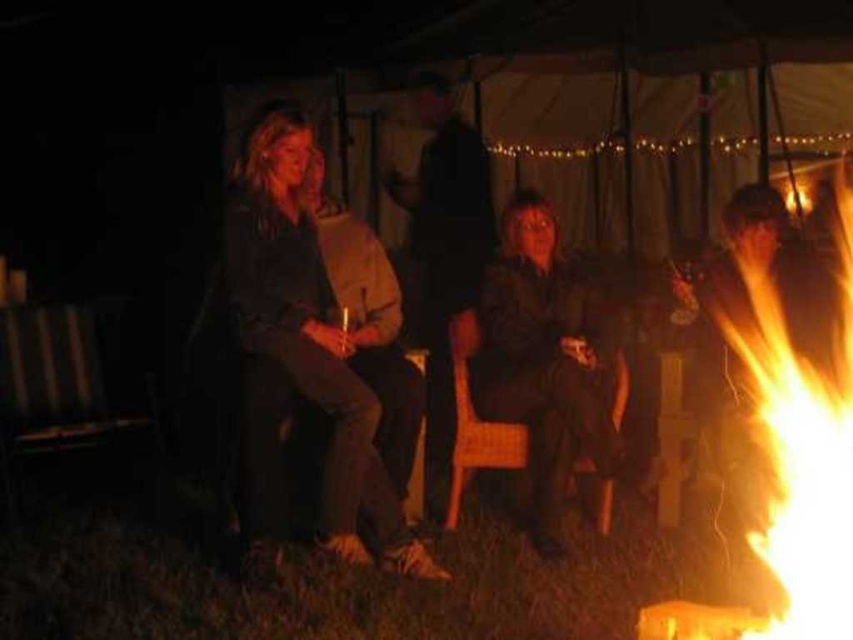
You are standing at the origin point of the coordinate system in the scene. The wooden slats chair at left is located at point 0.600, 0.080. If you want to move towards the campfire, which direction should you head from your current position?

The wooden slats chair at left is located at coordinates [67,384]. Since the campfire is the central focus of the scene and typically positioned at the center, moving towards the center coordinates would lead you toward the campfire.

You are standing near the campfire and want to place a small gift on the wooden chair at center without touching the dark brown leather jacket at center. Is this possible based on their positions?

The dark brown leather jacket at center is further to the viewer than the wooden chair at center, so placing the gift on the wooden chair at center without touching the jacket is possible as the chair is closer to you.